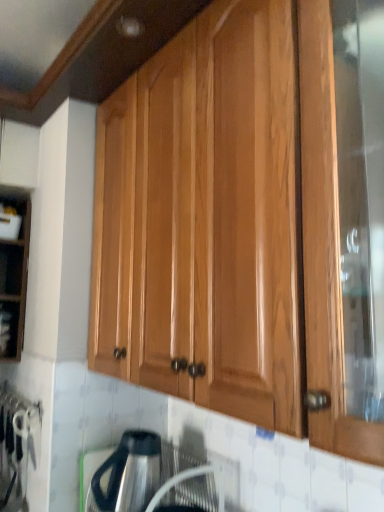
Question: Is satin silver kettle at lower center wider than glossy wood cabinet at upper center?

Choices:
 (A) yes
 (B) no

Answer: (B)

Question: Are satin silver kettle at lower center and glossy wood cabinet at upper center located far from each other?

Choices:
 (A) yes
 (B) no

Answer: (B)

Question: Considering the relative positions of satin silver kettle at lower center and glossy wood cabinet at upper center in the image provided, is satin silver kettle at lower center to the right of glossy wood cabinet at upper center from the viewer's perspective?

Choices:
 (A) yes
 (B) no

Answer: (B)

Question: From the image's perspective, would you say satin silver kettle at lower center is shown under glossy wood cabinet at upper center?

Choices:
 (A) yes
 (B) no

Answer: (A)

Question: Does satin silver kettle at lower center have a smaller size compared to glossy wood cabinet at upper center?

Choices:
 (A) yes
 (B) no

Answer: (A)

Question: Is glossy wood cabinet at upper center wider or thinner than matte black shelf at left?

Choices:
 (A) thin
 (B) wide

Answer: (B)

Question: From a real-world perspective, is glossy wood cabinet at upper center physically located above or below matte black shelf at left?

Choices:
 (A) below
 (B) above

Answer: (B)

Question: Based on their positions, is glossy wood cabinet at upper center located to the left or right of matte black shelf at left?

Choices:
 (A) left
 (B) right

Answer: (B)

Question: Is point (334, 169) closer or farther from the camera than point (18, 333)?

Choices:
 (A) farther
 (B) closer

Answer: (B)

Question: Considering their positions, is satin silver kettle at lower center located in front of or behind glossy wood cabinet at upper center?

Choices:
 (A) front
 (B) behind

Answer: (B)

Question: Is satin silver kettle at lower center wider or thinner than glossy wood cabinet at upper center?

Choices:
 (A) thin
 (B) wide

Answer: (A)

Question: From a real-world perspective, is satin silver kettle at lower center above or below glossy wood cabinet at upper center?

Choices:
 (A) below
 (B) above

Answer: (A)

Question: Is point (119, 476) closer or farther from the camera than point (312, 360)?

Choices:
 (A) farther
 (B) closer

Answer: (A)

Question: From the image's perspective, relative to glossy wood cabinet at upper center, is matte black shelf at left above or below?

Choices:
 (A) below
 (B) above

Answer: (A)

Question: Is matte black shelf at left to the left or to the right of glossy wood cabinet at upper center in the image?

Choices:
 (A) left
 (B) right

Answer: (A)